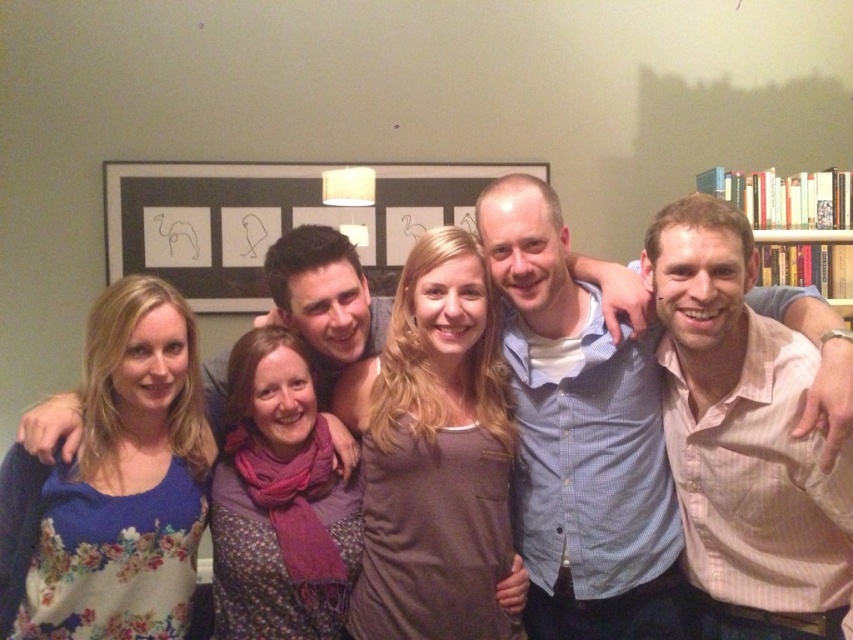
Which is more to the left, matte black picture frame at center or white wooden bookcase at right?

Positioned to the left is matte black picture frame at center.

In the scene shown: Between matte black picture frame at center and white wooden bookcase at right, which one is positioned higher?

Positioned higher is matte black picture frame at center.

Does point (418, 227) come in front of point (798, 212)?

No, it is behind (798, 212).

The height and width of the screenshot is (640, 853). I want to click on matte black picture frame at center, so click(270, 220).

Between floral fabric dress at center and white wooden bookcase at right, which one has more height?

white wooden bookcase at right

Which is above, floral fabric dress at center or white wooden bookcase at right?

white wooden bookcase at right is above.

Does point (219, 406) come behind point (712, 177)?

That is False.

Where is `floral fabric dress at center`? floral fabric dress at center is located at coordinates (341, 328).

Which is in front, point (799, 381) or point (244, 253)?

Point (799, 381) is in front.

Does pink striped shirt at center appear on the right side of matte black picture frame at center?

Yes, pink striped shirt at center is to the right of matte black picture frame at center.

Which is in front, point (671, 355) or point (177, 209)?

Point (671, 355) is in front.

Image resolution: width=853 pixels, height=640 pixels. Identify the location of pink striped shirt at center. (744, 440).